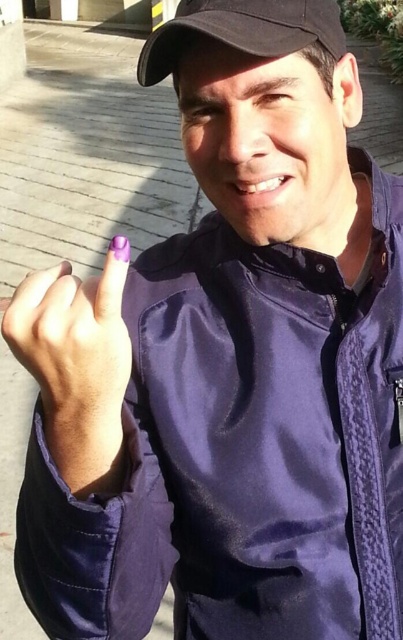
You are a photographer trying to capture a closeup of the purple painted nail at center and the black matte baseball cap at upper center. Since you want both objects in focus, which one should you adjust your camera focus on first?

The purple painted nail at center is in front of the black matte baseball cap at upper center, so you should focus on the purple painted nail at center first to ensure both are in focus.

You are a photographer who wants to capture a closeup shot of the purple painted nail at center and the black matte baseball cap at upper center. Based on their positions, which object should you focus on first to ensure both are in frame?

The purple painted nail at center is positioned under the black matte baseball cap at upper center, so you should focus on the black matte baseball cap at upper center first to ensure both are in frame.